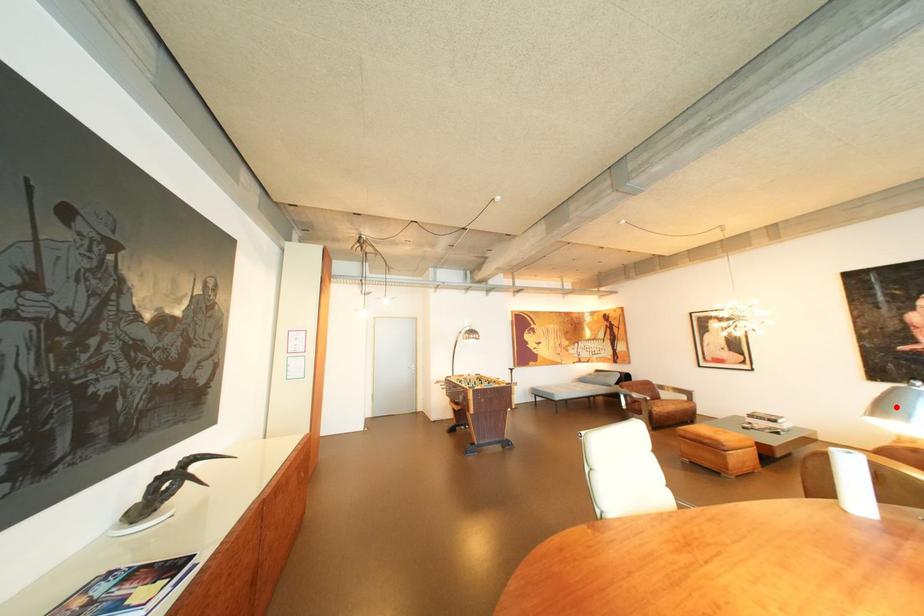
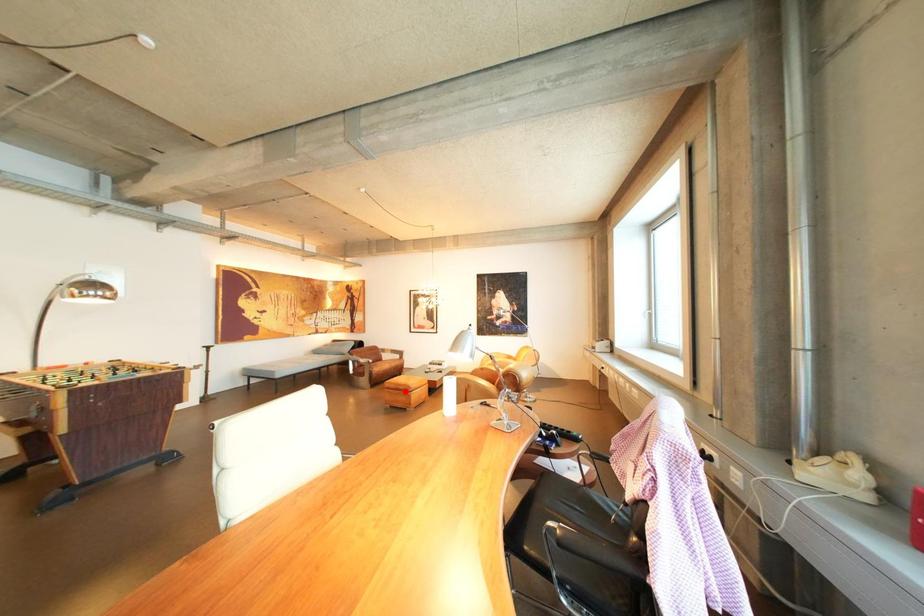
I am providing you with two images of the same scene from different viewpoints. A red point is marked on the first image and another point is marked on the second image. Is the marked point in image1 the same physical position as the marked point in image2?

No